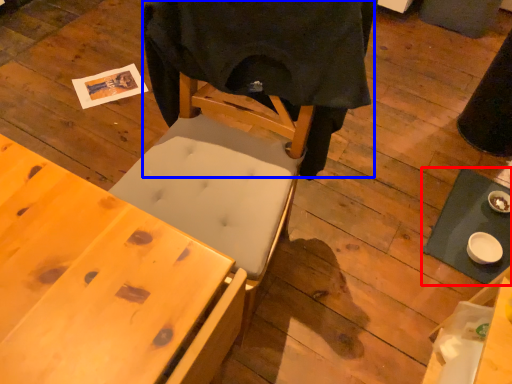
Question: Among these objects, which one is farthest to the camera, table (highlighted by a red box) or cloth (highlighted by a blue box)?

Choices:
 (A) table
 (B) cloth

Answer: (A)